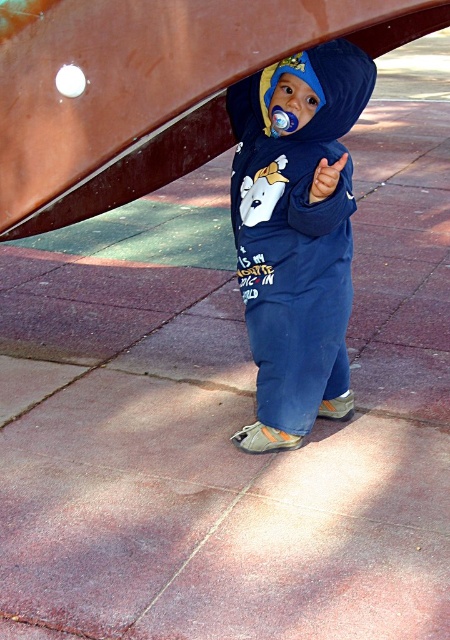
Question: Is navy blue fleece onesie at center below rubber teething ring at center?

Choices:
 (A) yes
 (B) no

Answer: (A)

Question: Which point is closer to the camera taking this photo?

Choices:
 (A) (319, 189)
 (B) (358, 109)

Answer: (A)

Question: Which point is farther to the camera?

Choices:
 (A) (311, 182)
 (B) (262, 298)

Answer: (B)

Question: Does navy blue fleece onesie at center lie behind rubber teething ring at center?

Choices:
 (A) yes
 (B) no

Answer: (B)

Question: Which point appears closest to the camera in this image?

Choices:
 (A) (289, 332)
 (B) (319, 170)

Answer: (B)

Question: Can you confirm if navy blue fleece onesie at center is positioned to the left of rubber teething ring at center?

Choices:
 (A) yes
 (B) no

Answer: (B)